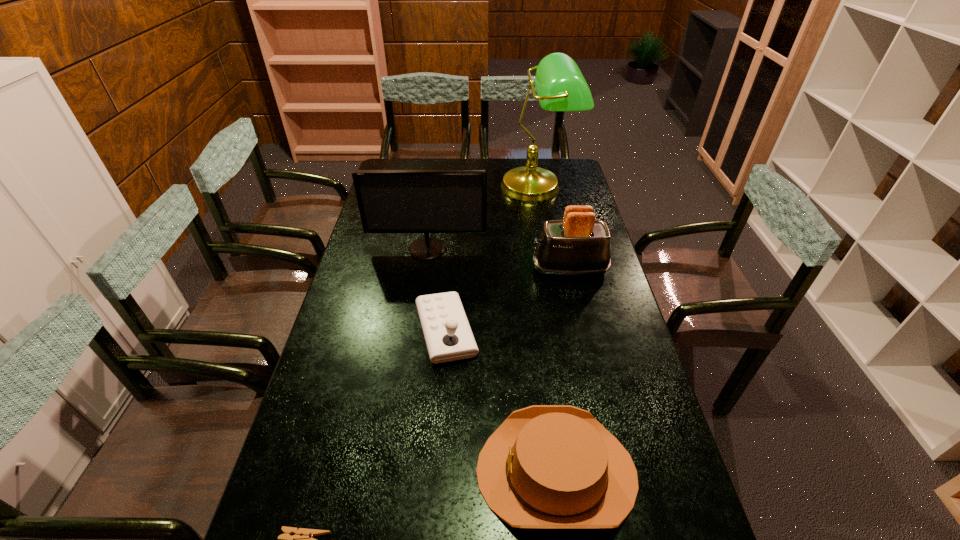
Where is `free space between the tallest object and the third nearest object`? free space between the tallest object and the third nearest object is located at coordinates pyautogui.click(x=492, y=260).

Where is `the third closest object to the cowboy hat`? The height and width of the screenshot is (540, 960). the third closest object to the cowboy hat is located at coordinates (578, 245).

Where is `object that is the fourth closest to the computer monitor`? The image size is (960, 540). object that is the fourth closest to the computer monitor is located at coordinates (546, 466).

Locate an element on the screen. vacant area in the image that satisfies the following two spatial constraints: 1. on the desk next to the lamp; 2. on the front-facing side of the second shortest object is located at coordinates (590, 471).

Find the location of a particular element. Image resolution: width=960 pixels, height=540 pixels. vacant space that satisfies the following two spatial constraints: 1. on the desk next to the lamp; 2. on the front-facing side of the second shortest object is located at coordinates (590, 471).